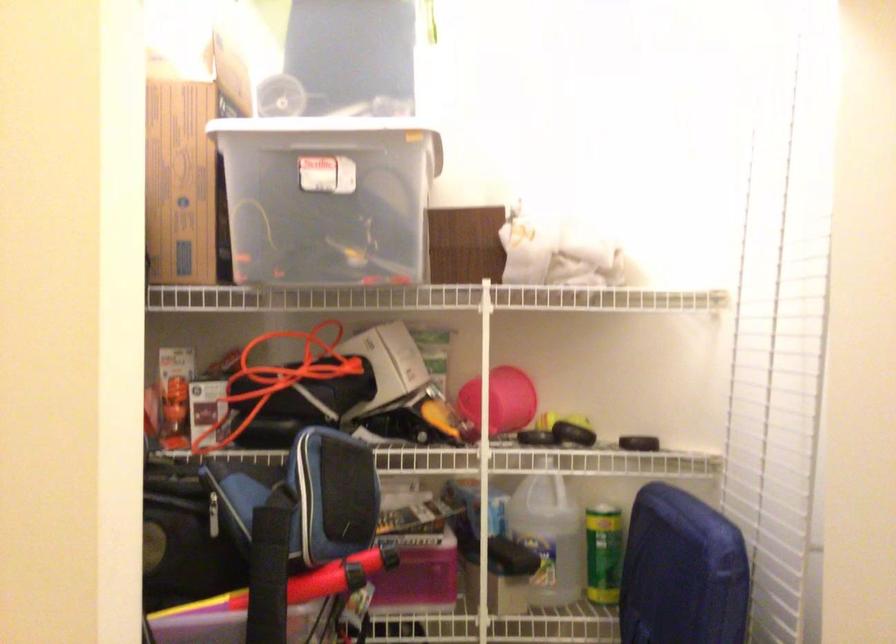
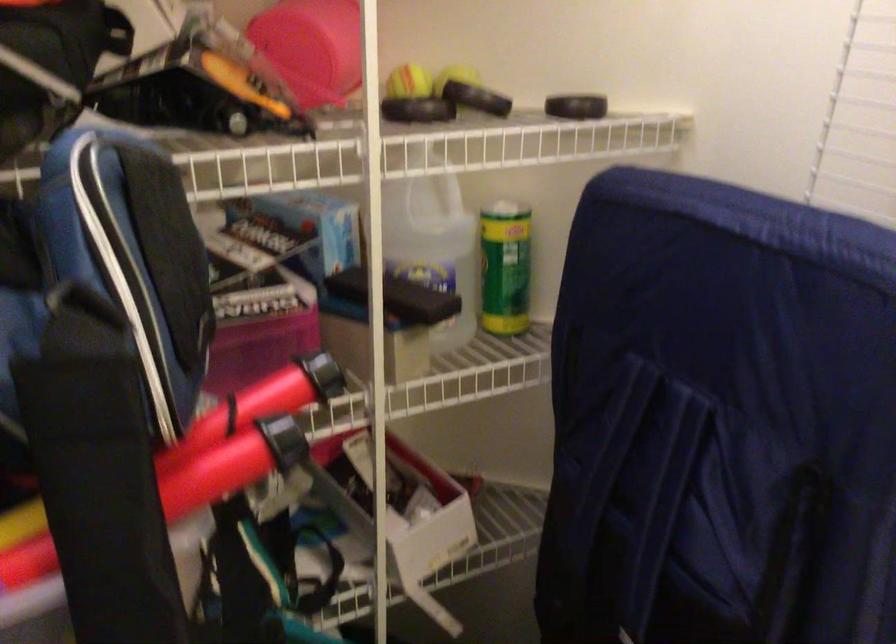
Where in the second image is the point corresponding to (572,438) from the first image?

(487, 100)